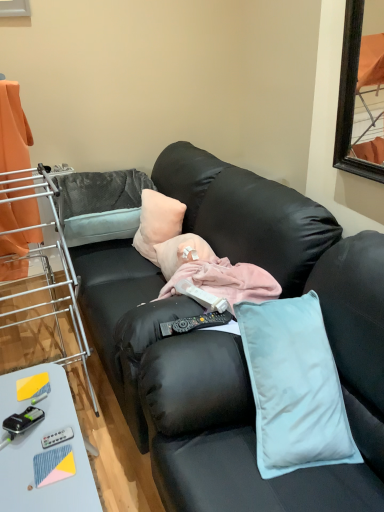
Locate an element on the screen. vacant point above light blue plastic table at lower left (from a real-world perspective) is located at coordinates (34, 428).